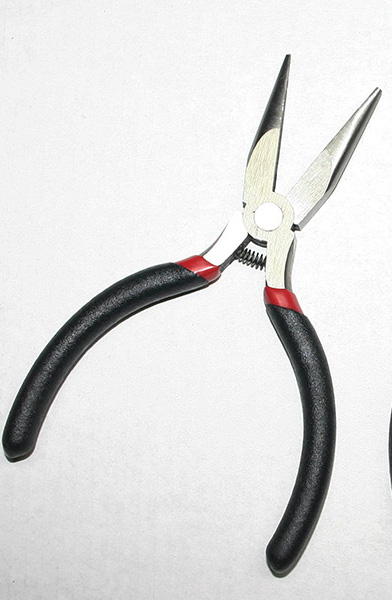
Find the location of a particular element. Image resolution: width=392 pixels, height=600 pixels. table is located at coordinates (200, 455).